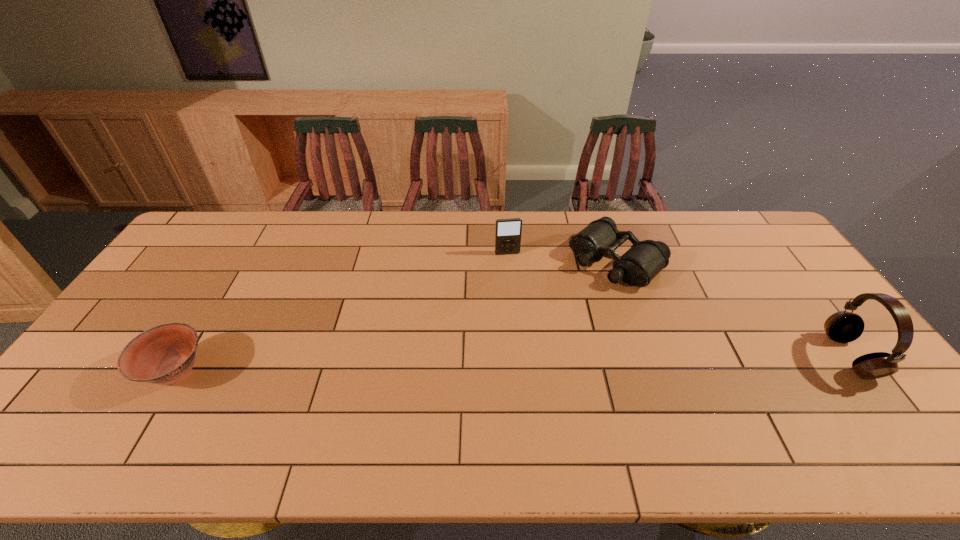
I want to click on object situated at the near right corner, so click(843, 327).

Identify the location of vacant space at the far edge of the desktop. Image resolution: width=960 pixels, height=540 pixels. (614, 217).

The height and width of the screenshot is (540, 960). In the image, there is a desktop. Find the location of `free space at the near edge`. free space at the near edge is located at coordinates (502, 408).

Locate an element on the screen. The height and width of the screenshot is (540, 960). vacant region at the near right corner of the desktop is located at coordinates (886, 405).

Where is `free point between the bowl and the binoculars`? Image resolution: width=960 pixels, height=540 pixels. free point between the bowl and the binoculars is located at coordinates (396, 316).

The width and height of the screenshot is (960, 540). In order to click on unoccupied area between the second object from left to right and the tallest object in this screenshot , I will do `click(679, 305)`.

In order to click on unoccupied position between the second object from left to right and the binoculars in this screenshot , I will do `click(562, 257)`.

This screenshot has width=960, height=540. In order to click on free space between the leftmost object and the headset in this screenshot , I will do `click(513, 364)`.

You are a GUI agent. You are given a task and a screenshot of the screen. Output one action in this format:
    pyautogui.click(x=<x>, y=<y>)
    Task: Click on the vacant space in between the rightmost object and the second object from left to right
    This screenshot has height=540, width=960.
    Given the screenshot: What is the action you would take?
    pyautogui.click(x=679, y=305)

Image resolution: width=960 pixels, height=540 pixels. In order to click on blank region between the third object from left to right and the rightmost object in this screenshot , I will do `click(732, 308)`.